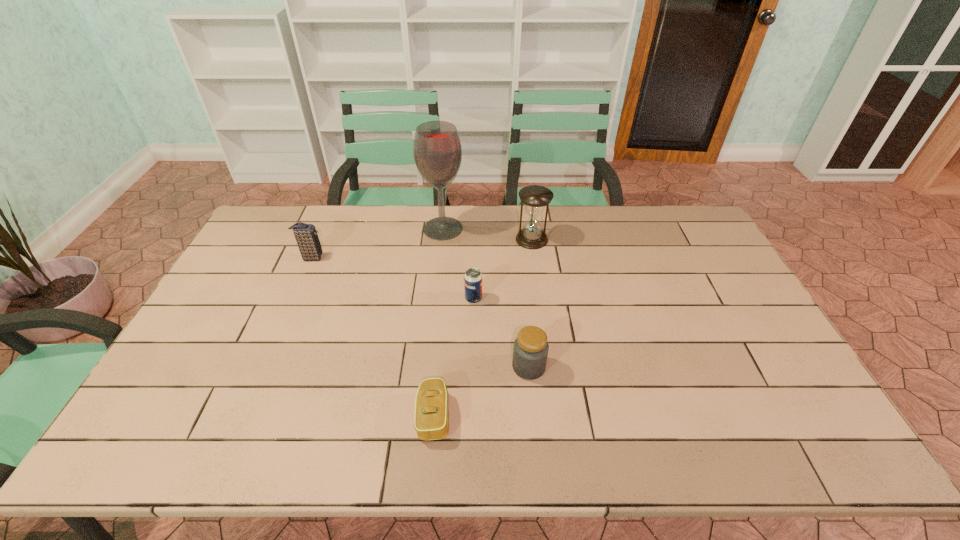
Locate an element on the screen. This screenshot has height=540, width=960. the tallest object is located at coordinates (437, 151).

At what (x,y) coordinates should I click in order to perform the action: click on hourglass. Please return your answer as a coordinate pair (x, y). Looking at the image, I should click on (535, 197).

Identify the location of the leftmost object. This screenshot has width=960, height=540. (306, 236).

In order to click on the farther clutch bag in this screenshot , I will do `click(306, 236)`.

This screenshot has height=540, width=960. Find the location of `the second nearest object`. the second nearest object is located at coordinates (530, 352).

Locate an element on the screen. The image size is (960, 540). the fourth object from left to right is located at coordinates (473, 278).

The width and height of the screenshot is (960, 540). Find the location of `beer can`. beer can is located at coordinates (473, 278).

Where is `the nearest object`? The image size is (960, 540). the nearest object is located at coordinates (431, 422).

Identify the location of the shorter clutch bag. The image size is (960, 540). (431, 422).

Find the location of `vacant region located on the right of the alcohol`. vacant region located on the right of the alcohol is located at coordinates (543, 228).